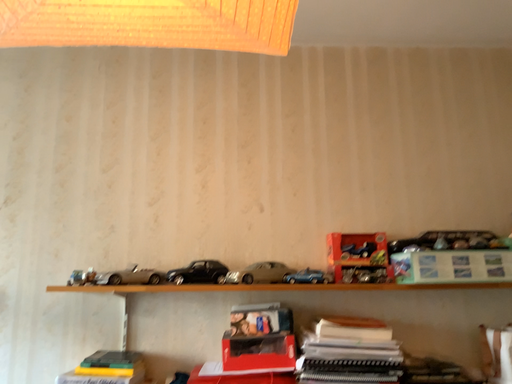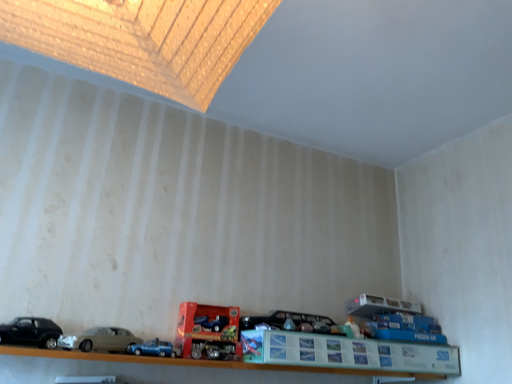
Question: Which way did the camera rotate in the video?

Choices:
 (A) rotated left
 (B) rotated right

Answer: (B)